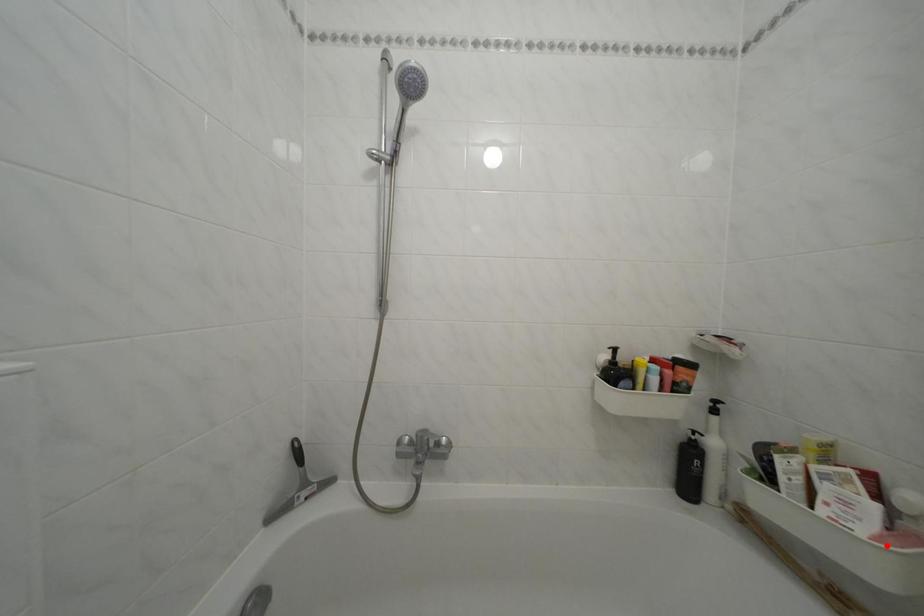
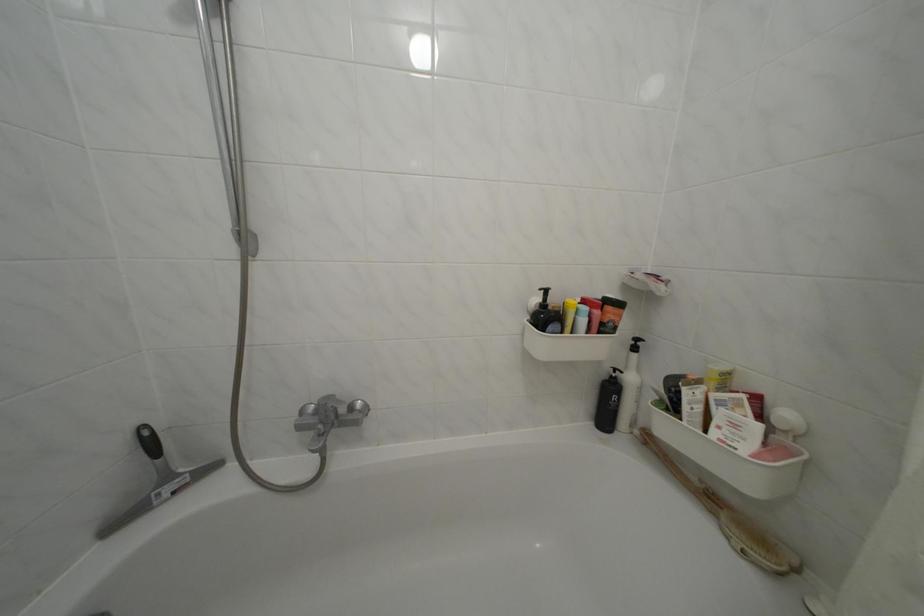
Find the pixel in the second image that matches the highlighted location in the first image.

(766, 462)